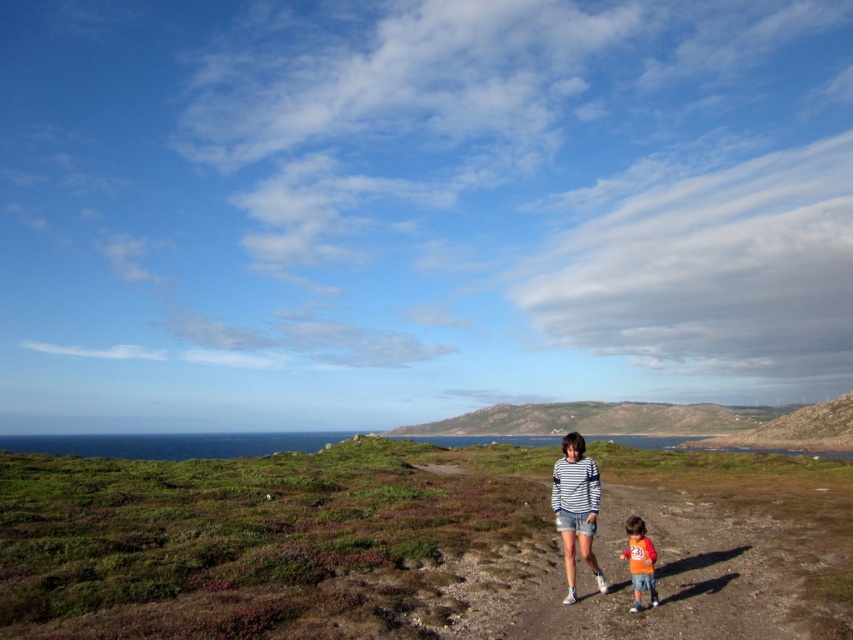
Is brown dirt path at center positioned behind orange cotton shirt at lower center?

No, brown dirt path at center is closer to the viewer.

Is brown dirt path at center taller than orange cotton shirt at lower center?

Yes, brown dirt path at center is taller than orange cotton shirt at lower center.

Who is more distant from viewer, (680,483) or (636,588)?

The point (680,483) is more distant.

Locate an element on the screen. brown dirt path at center is located at coordinates (699, 554).

Can you confirm if striped shirt at center is positioned to the right of orange cotton shirt at lower center?

Correct, you'll find striped shirt at center to the right of orange cotton shirt at lower center.

Find the location of a particular element. Image resolution: width=853 pixels, height=640 pixels. striped shirt at center is located at coordinates (576, 508).

Is brown dirt path at center further to camera compared to striped shirt at center?

No, it is in front of striped shirt at center.

This screenshot has height=640, width=853. Describe the element at coordinates (699, 554) in the screenshot. I see `brown dirt path at center` at that location.

The height and width of the screenshot is (640, 853). Find the location of `brown dirt path at center`. brown dirt path at center is located at coordinates (699, 554).

At what (x,y) coordinates should I click in order to perform the action: click on brown dirt path at center. Please return your answer as a coordinate pair (x, y). Looking at the image, I should click on [x=699, y=554].